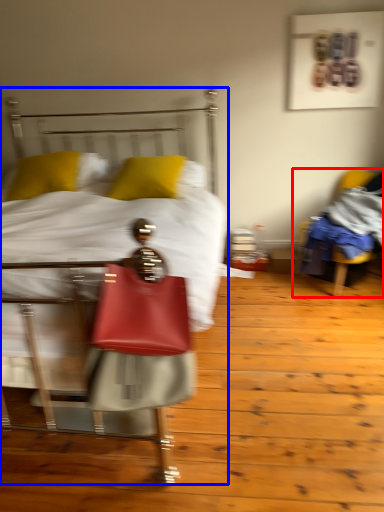
Question: Which point is closer to the camera, chair (highlighted by a red box) or bed (highlighted by a blue box)?

Choices:
 (A) chair
 (B) bed

Answer: (B)